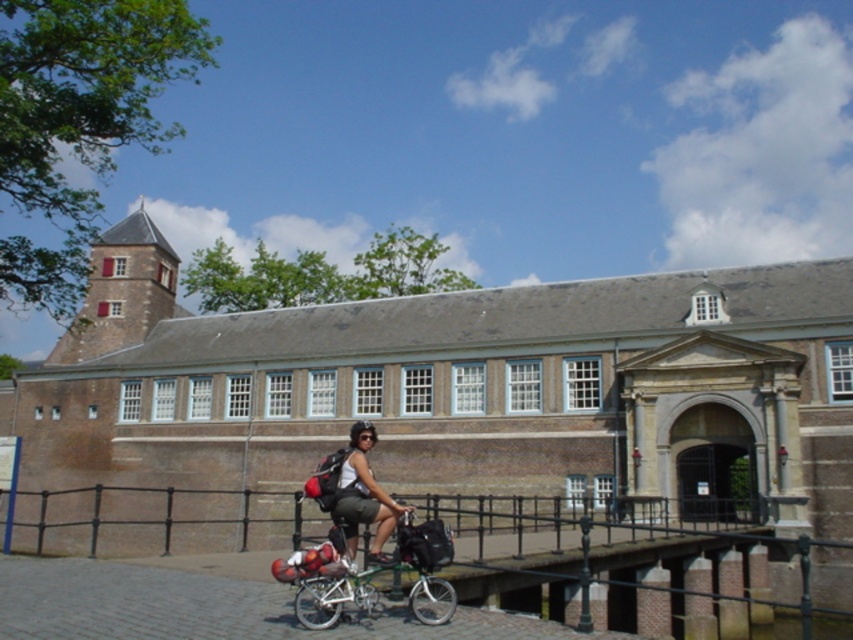
You are a cyclist approaching the bridge and need to secure your matte black backpack at center to the black metal railing at center. Based on their positions, which object is on the left side where you can attach the backpack?

The black metal railing at center is positioned on the left side of the matte black backpack at center, so you can attach the backpack to the railing on its left.

You are a cyclist approaching the bridge in the scene. You have a matte black backpack at center. As you ride under the black metal railing at center, will you need to duck your head to avoid hitting it?

The black metal railing at center is much taller than the matte black backpack at center, so you will not need to duck your head as you ride under it.